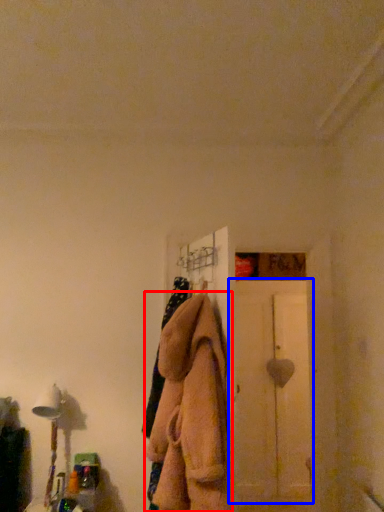
Question: Among these objects, which one is farthest to the camera, clothing (highlighted by a red box) or screen door (highlighted by a blue box)?

Choices:
 (A) clothing
 (B) screen door

Answer: (B)